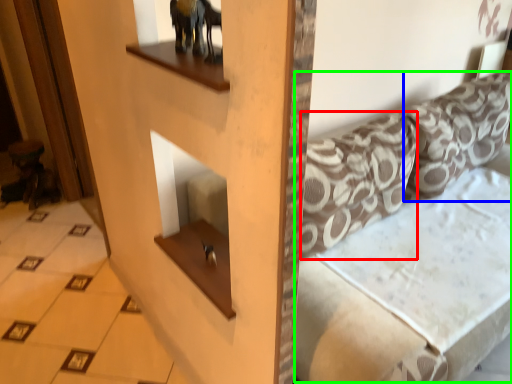
Question: Considering the real-world distances, which object is closest to pillow (highlighted by a red box)? pillow (highlighted by a blue box) or couch (highlighted by a green box).

Choices:
 (A) pillow
 (B) couch

Answer: (B)